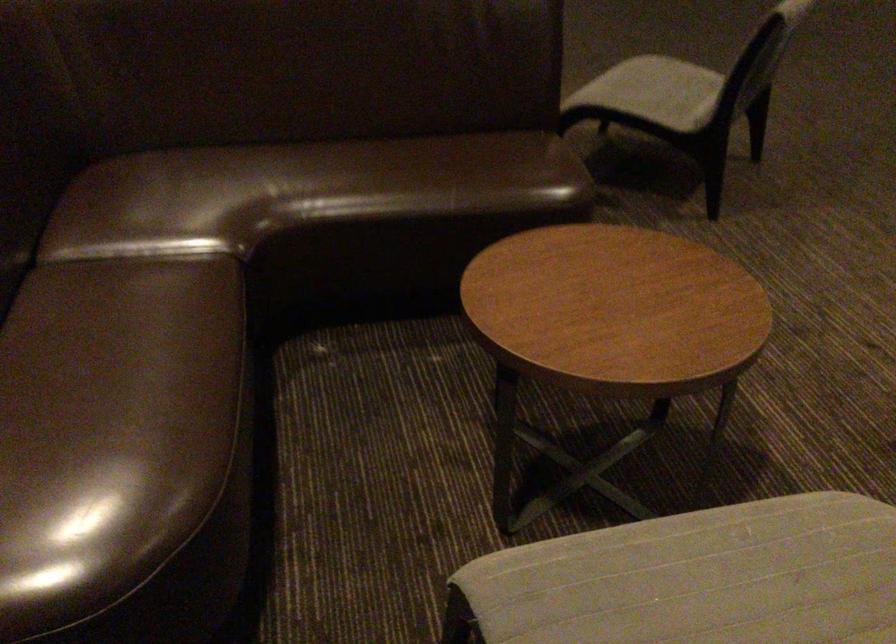
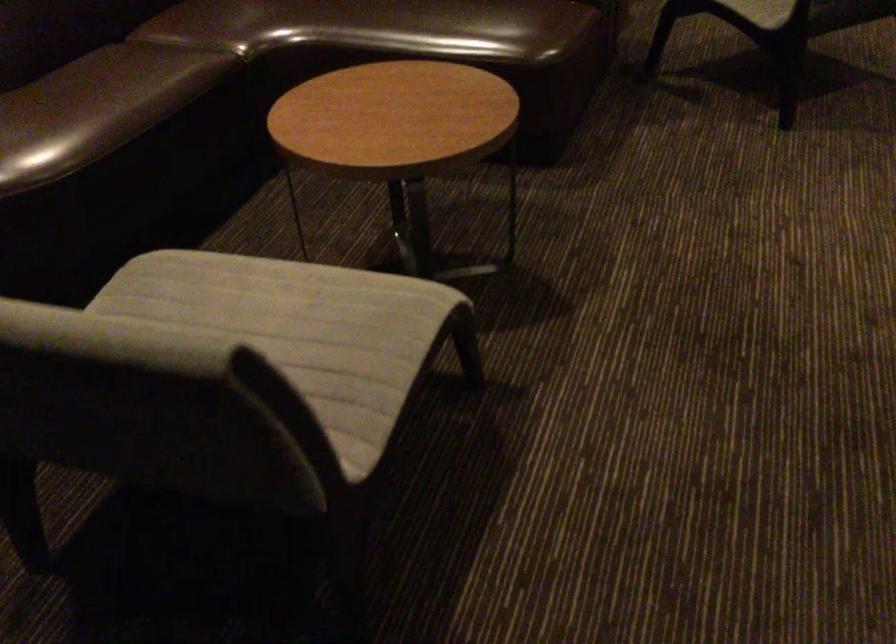
In the second image, find the point that corresponds to the point at 464,182 in the first image.

(444, 26)